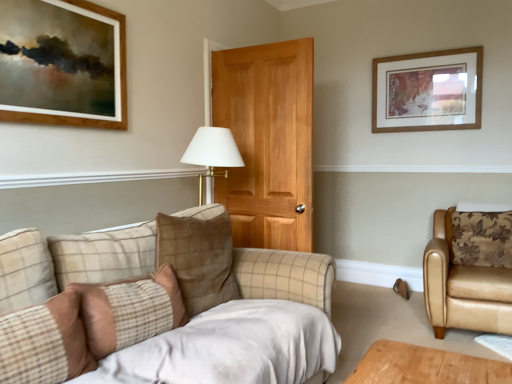
Locate an element on the screen. vacant area on top of wooden framed artwork at upper right (from a real-world perspective) is located at coordinates (426, 47).